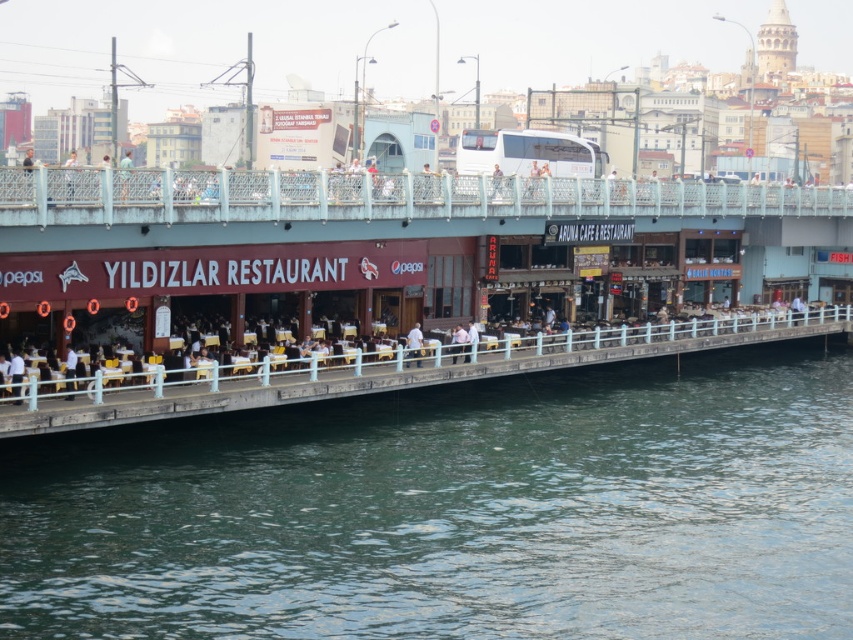
Can you confirm if metallic bridge at upper center is thinner than white plastic chair at upper center?

Correct, metallic bridge at upper center's width is less than white plastic chair at upper center's.

Who is more forward, [236,179] or [102,170]?

Positioned in front is point [102,170].

The width and height of the screenshot is (853, 640). Describe the element at coordinates (386, 196) in the screenshot. I see `metallic bridge at upper center` at that location.

Image resolution: width=853 pixels, height=640 pixels. In order to click on metallic bridge at upper center in this screenshot , I will do `click(386, 196)`.

Does point (695, 179) come in front of point (408, 364)?

No.

Between metallic bridge at upper center and white fabric shirt at center, which one has more height?

metallic bridge at upper center is taller.

Is point (682, 182) in front of point (419, 324)?

No.

In order to click on metallic bridge at upper center in this screenshot , I will do `click(386, 196)`.

Does point (231, 289) lie behind point (67, 397)?

Yes, point (231, 289) is farther from viewer.

Can you confirm if brown wooden restaurant at center is shorter than white fabric shirt at lower left?

Incorrect, brown wooden restaurant at center's height does not fall short of white fabric shirt at lower left's.

Does point (347, 202) come in front of point (68, 365)?

No, (347, 202) is behind (68, 365).

Image resolution: width=853 pixels, height=640 pixels. What are the coordinates of `brown wooden restaurant at center` in the screenshot? It's located at (393, 268).